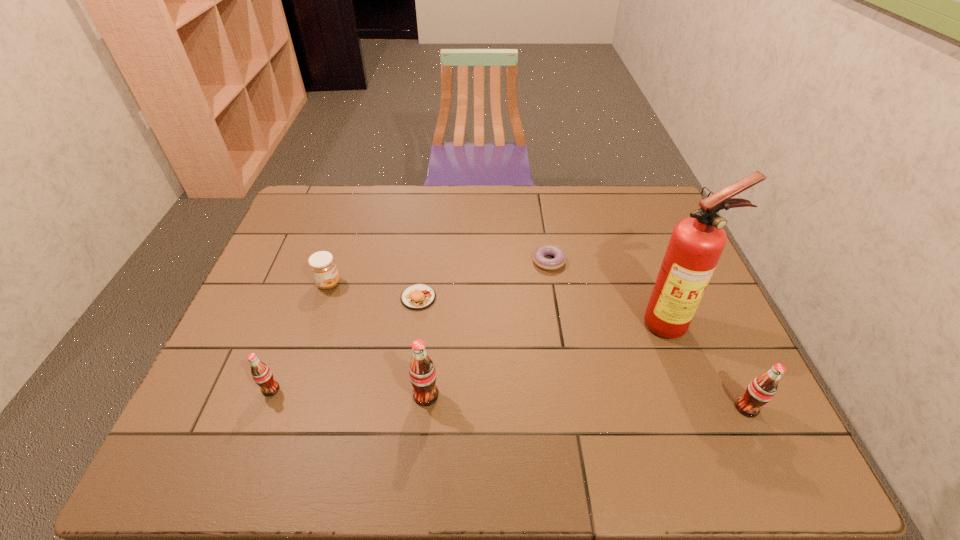
Image resolution: width=960 pixels, height=540 pixels. In order to click on fire extinguisher situated at the right edge in this screenshot , I will do `click(696, 244)`.

At what (x,y) coordinates should I click in order to perform the action: click on object that is at the near left corner. Please return your answer as a coordinate pair (x, y). The width and height of the screenshot is (960, 540). Looking at the image, I should click on (261, 373).

The height and width of the screenshot is (540, 960). I want to click on object that is at the near right corner, so click(x=761, y=390).

Locate an element on the screen. vacant region at the far edge of the desktop is located at coordinates (381, 187).

Locate an element on the screen. vacant space at the left edge is located at coordinates (256, 286).

The width and height of the screenshot is (960, 540). In order to click on free space at the right edge of the desktop in this screenshot , I will do click(x=708, y=303).

Where is `free space at the far left corner of the desktop`? Image resolution: width=960 pixels, height=540 pixels. free space at the far left corner of the desktop is located at coordinates (327, 226).

The image size is (960, 540). In order to click on vacant space at the near left corner in this screenshot , I will do `click(221, 401)`.

Locate an element on the screen. blank region between the jam and the rightmost soda is located at coordinates (538, 346).

Where is `unoccupied area between the fourth tallest object and the fire extinguisher`? The width and height of the screenshot is (960, 540). unoccupied area between the fourth tallest object and the fire extinguisher is located at coordinates (470, 356).